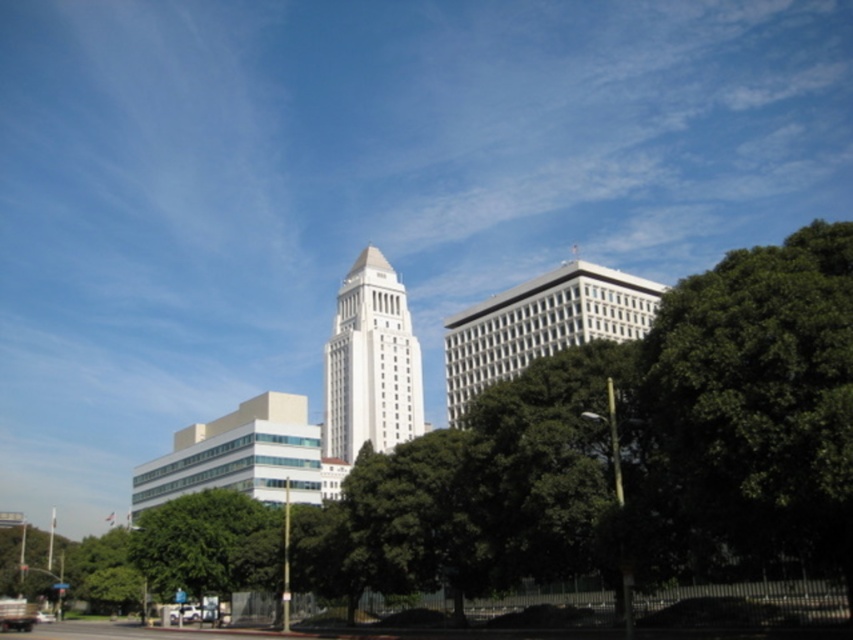
Question: Which point is closer to the camera?

Choices:
 (A) white smooth tower at center
 (B) white glass building at center

Answer: (B)

Question: Observing the image, what is the correct spatial positioning of green leafy tree at right in reference to white glass building at center?

Choices:
 (A) above
 (B) below

Answer: (A)

Question: Among these objects, which one is nearest to the camera?

Choices:
 (A) green leafy tree at lower left
 (B) white glass building at center
 (C) white smooth tower at center
 (D) green leafy tree at right

Answer: (D)

Question: Is green leafy tree at center positioned behind green leafy tree at lower left?

Choices:
 (A) no
 (B) yes

Answer: (A)

Question: Considering the real-world distances, which object is farthest from the green leafy tree at center?

Choices:
 (A) green leafy tree at lower left
 (B) white smooth tower at center
 (C) green leafy tree at right
 (D) white glass building at center

Answer: (B)

Question: Can you confirm if green leafy tree at right is wider than green leafy tree at lower left?

Choices:
 (A) yes
 (B) no

Answer: (B)